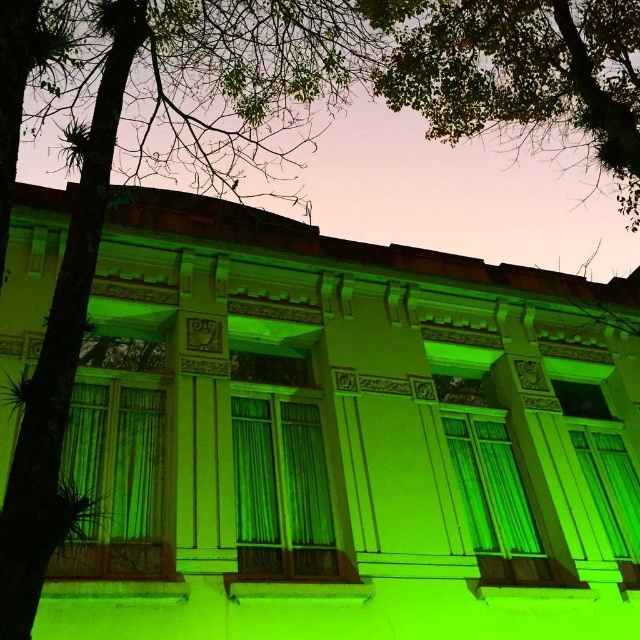
Question: Can you confirm if green leafy tree at upper left is wider than green fabric curtain at center?

Choices:
 (A) yes
 (B) no

Answer: (A)

Question: Estimate the real-world distances between objects in this image. Which object is farther from the green glass window at center?

Choices:
 (A) green fabric curtain at center
 (B) green leafy tree at upper left

Answer: (B)

Question: Among these points, which one is nearest to the camera?

Choices:
 (A) (278, 497)
 (B) (582, 470)
 (C) (472, 461)

Answer: (A)

Question: Is green leafy tree at upper left below green leafy tree at upper center?

Choices:
 (A) yes
 (B) no

Answer: (A)

Question: Does green leafy tree at upper left have a greater width compared to matte glass window at center?

Choices:
 (A) no
 (B) yes

Answer: (B)

Question: Estimate the real-world distances between objects in this image. Which object is closer to the green glass window at center?

Choices:
 (A) green leafy tree at upper center
 (B) green fabric curtain at center
 (C) green leafy tree at upper left
 (D) matte glass window at center

Answer: (D)